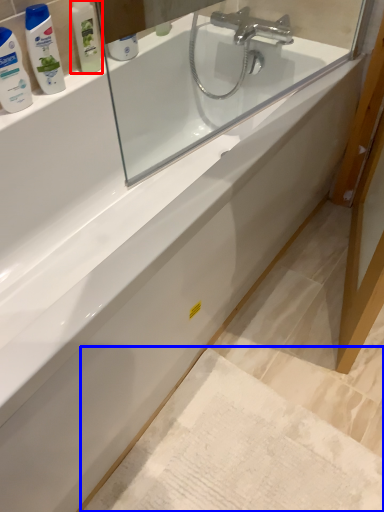
Question: Which of the following is the closest to the observer, toiletry (highlighted by a red box) or bath mat (highlighted by a blue box)?

Choices:
 (A) toiletry
 (B) bath mat

Answer: (B)